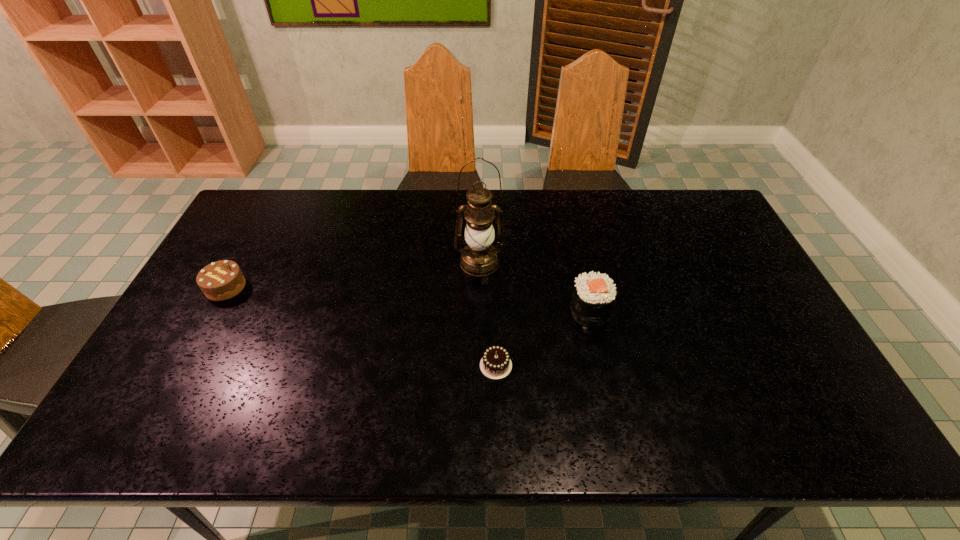
The width and height of the screenshot is (960, 540). I want to click on free space between the oil lamp and the sushi, so click(x=535, y=287).

Locate an element on the screen. The width and height of the screenshot is (960, 540). free area in between the tallest object and the nearest object is located at coordinates (488, 314).

Where is `free space between the left chocolate cake and the oil lamp`? The width and height of the screenshot is (960, 540). free space between the left chocolate cake and the oil lamp is located at coordinates (352, 275).

Where is `free spot between the oil lamp and the sushi`? free spot between the oil lamp and the sushi is located at coordinates (535, 287).

The image size is (960, 540). Find the location of `blank region between the tallest object and the shorter chocolate cake`. blank region between the tallest object and the shorter chocolate cake is located at coordinates (488, 314).

This screenshot has width=960, height=540. Find the location of `empty space between the oil lamp and the right chocolate cake`. empty space between the oil lamp and the right chocolate cake is located at coordinates (488, 314).

The height and width of the screenshot is (540, 960). What are the coordinates of `free spot between the leftmost object and the right chocolate cake` in the screenshot? It's located at (361, 326).

In order to click on unoccupied position between the oil lamp and the leftmost object in this screenshot , I will do `click(352, 275)`.

Select which object appears as the third closest to the taller chocolate cake. Please provide its 2D coordinates. Your answer should be formatted as a tuple, i.e. [(x, y)], where the tuple contains the x and y coordinates of a point satisfying the conditions above.

[(593, 297)]

This screenshot has width=960, height=540. What are the coordinates of `the closest object relative to the second tallest object` in the screenshot? It's located at (495, 364).